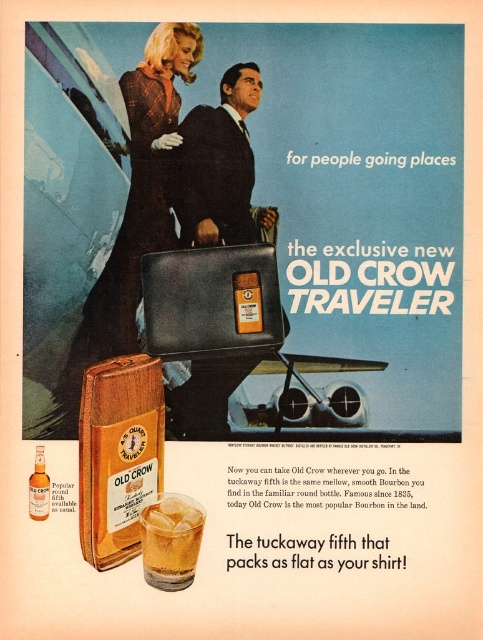
You are an airport security officer examining an Xray image of a suitcase. You notice a point at coordinates (221, 166). According to the image description, what object is located at that point?

The point at coordinates (221, 166) corresponds to the matte black briefcase at center.

You are a customer in a store looking at the Old Crow Traveler advertisement. You see the plaid wool coat at center and the amber liquid glass at lower center. Which object is closer to you?

The plaid wool coat at center is closer to you because the amber liquid glass at lower center is behind it.